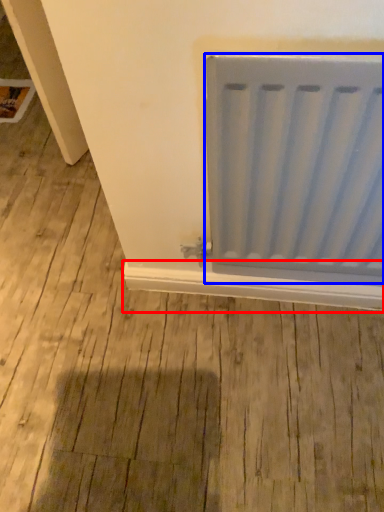
Question: Which of the following is the farthest to the observer, window sill (highlighted by a red box) or radiator (highlighted by a blue box)?

Choices:
 (A) window sill
 (B) radiator

Answer: (A)